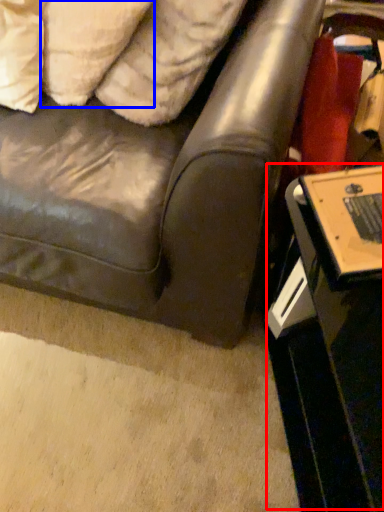
Question: Among these objects, which one is nearest to the camera, table (highlighted by a red box) or pillow (highlighted by a blue box)?

Choices:
 (A) table
 (B) pillow

Answer: (A)